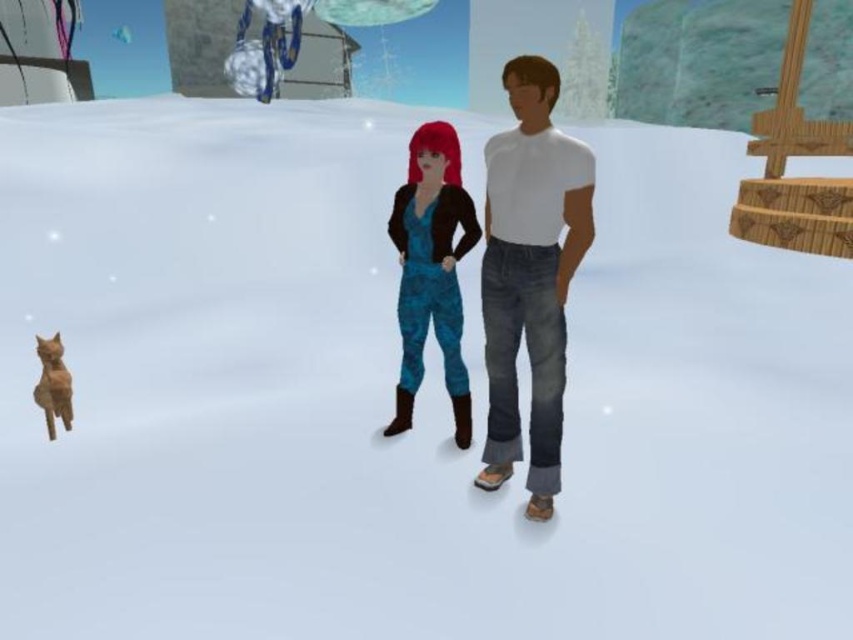
Question: Can you confirm if blue camouflage jumpsuit at center is smaller than orange fur cat at lower left?

Choices:
 (A) yes
 (B) no

Answer: (B)

Question: Among these objects, which one is nearest to the camera?

Choices:
 (A) orange fur cat at lower left
 (B) blue camouflage jumpsuit at center

Answer: (B)

Question: Considering the relative positions of white matte shirt at center and blue camouflage jumpsuit at center in the image provided, where is white matte shirt at center located with respect to blue camouflage jumpsuit at center?

Choices:
 (A) right
 (B) left

Answer: (A)

Question: Is white matte shirt at center in front of blue camouflage jumpsuit at center?

Choices:
 (A) yes
 (B) no

Answer: (A)

Question: Based on their relative distances, which object is farther from the orange fur cat at lower left?

Choices:
 (A) blue camouflage jumpsuit at center
 (B) white matte shirt at center

Answer: (B)

Question: Which of the following is the closest to the observer?

Choices:
 (A) white matte shirt at center
 (B) orange fur cat at lower left

Answer: (A)